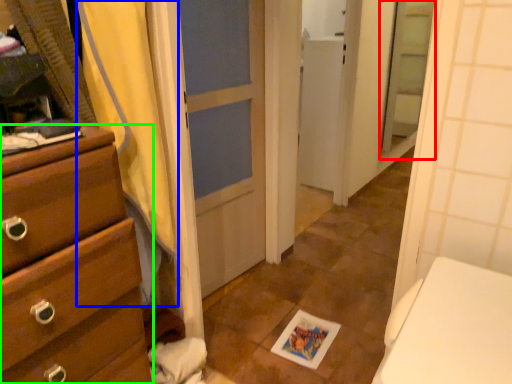
Question: Based on their relative distances, which object is nearer to screen door (highlighted by a red box)? Choose from shower curtain (highlighted by a blue box) and chest of drawers (highlighted by a green box).

Choices:
 (A) shower curtain
 (B) chest of drawers

Answer: (A)